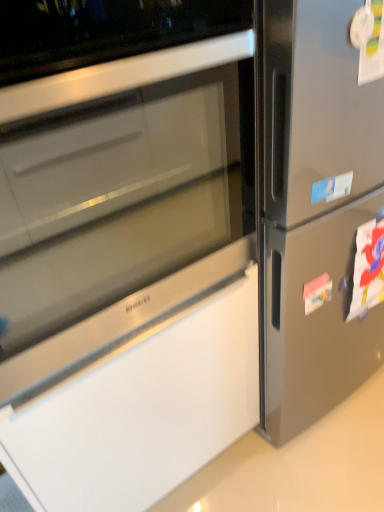
Measure the distance between blue paper sticker at upper right, which is the 1th sticker from front to back, and camera.

blue paper sticker at upper right, which is the 1th sticker from front to back, is 32.13 inches away from camera.

Identify the location of blue paper sticker at upper right, which is the 1th sticker from front to back. (332, 188).

What do you see at coordinates (332, 188) in the screenshot? I see `blue paper sticker at upper right, which is the 1th sticker from front to back` at bounding box center [332, 188].

How much space does blue paper sticker at upper right, positioned as the 2th sticker in bottom-to-top order, occupy vertically?

It is 2.30 inches.

What do you see at coordinates (317, 292) in the screenshot?
I see `pink matte paper at right, positioned as the second sticker in top-to-bottom order` at bounding box center [317, 292].

Locate an element on the screen. pink matte paper at right, which appears as the 1th sticker when viewed from the back is located at coordinates (317, 292).

The height and width of the screenshot is (512, 384). Find the location of `blue paper sticker at upper right, the 2th sticker viewed from the back`. blue paper sticker at upper right, the 2th sticker viewed from the back is located at coordinates (332, 188).

Which object is positioned more to the right, pink matte paper at right, positioned as the second sticker in top-to-bottom order, or blue paper sticker at upper right, positioned as the 2th sticker in bottom-to-top order?

From the viewer's perspective, pink matte paper at right, positioned as the second sticker in top-to-bottom order, appears more on the right side.

Which is behind, pink matte paper at right, positioned as the second sticker in top-to-bottom order, or blue paper sticker at upper right, positioned as the 2th sticker in bottom-to-top order?

pink matte paper at right, positioned as the second sticker in top-to-bottom order, is behind.

Which is nearer, (323,276) or (339,179)?

Positioned in front is point (339,179).

From the image's perspective, which is above, pink matte paper at right, positioned as the first sticker in bottom-to-top order, or blue paper sticker at upper right, positioned as the 2th sticker in bottom-to-top order?

blue paper sticker at upper right, positioned as the 2th sticker in bottom-to-top order, from the image's perspective.

From a real-world perspective, is pink matte paper at right, positioned as the second sticker in top-to-bottom order, physically located above or below blue paper sticker at upper right, the 2th sticker viewed from the back?

pink matte paper at right, positioned as the second sticker in top-to-bottom order, is situated lower than blue paper sticker at upper right, the 2th sticker viewed from the back, in the real world.

Considering the sizes of objects pink matte paper at right, positioned as the second sticker in top-to-bottom order, and blue paper sticker at upper right, positioned as the 2th sticker in bottom-to-top order, in the image provided, who is wider, pink matte paper at right, positioned as the second sticker in top-to-bottom order, or blue paper sticker at upper right, positioned as the 2th sticker in bottom-to-top order,?

pink matte paper at right, positioned as the second sticker in top-to-bottom order.

Is pink matte paper at right, positioned as the first sticker in bottom-to-top order, taller or shorter than blue paper sticker at upper right, positioned as the 2th sticker in bottom-to-top order?

Considering their sizes, pink matte paper at right, positioned as the first sticker in bottom-to-top order, has more height than blue paper sticker at upper right, positioned as the 2th sticker in bottom-to-top order.

Does pink matte paper at right, which appears as the 1th sticker when viewed from the back, have a smaller size compared to blue paper sticker at upper right, which is the 1th sticker from front to back?

Actually, pink matte paper at right, which appears as the 1th sticker when viewed from the back, might be larger than blue paper sticker at upper right, which is the 1th sticker from front to back.

Would you say pink matte paper at right, which appears as the 1th sticker when viewed from the back, contains blue paper sticker at upper right, positioned as the 2th sticker in bottom-to-top order?

No, blue paper sticker at upper right, positioned as the 2th sticker in bottom-to-top order, is not inside pink matte paper at right, which appears as the 1th sticker when viewed from the back.

Are pink matte paper at right, positioned as the first sticker in bottom-to-top order, and blue paper sticker at upper right, positioned as the 2th sticker in bottom-to-top order, far apart?

No.

Could you tell me if pink matte paper at right, positioned as the first sticker in bottom-to-top order, is facing blue paper sticker at upper right, which appears as the first sticker when viewed from the top?

No, pink matte paper at right, positioned as the first sticker in bottom-to-top order, does not turn towards blue paper sticker at upper right, which appears as the first sticker when viewed from the top.

Can you tell me how much pink matte paper at right, positioned as the first sticker in bottom-to-top order, and blue paper sticker at upper right, positioned as the 2th sticker in bottom-to-top order, differ in facing direction?

0.0216 degrees separate the facing orientations of pink matte paper at right, positioned as the first sticker in bottom-to-top order, and blue paper sticker at upper right, positioned as the 2th sticker in bottom-to-top order.

This screenshot has height=512, width=384. I want to click on sticker located below the blue paper sticker at upper right, positioned as the 2th sticker in bottom-to-top order (from the image's perspective), so click(317, 292).

Looking at this image, considering the relative positions of blue paper sticker at upper right, the 2th sticker viewed from the back, and pink matte paper at right, positioned as the first sticker in bottom-to-top order, in the image provided, is blue paper sticker at upper right, the 2th sticker viewed from the back, to the right of pink matte paper at right, positioned as the first sticker in bottom-to-top order, from the viewer's perspective?

In fact, blue paper sticker at upper right, the 2th sticker viewed from the back, is to the left of pink matte paper at right, positioned as the first sticker in bottom-to-top order.

Is blue paper sticker at upper right, positioned as the 2th sticker in bottom-to-top order, closer to camera compared to pink matte paper at right, positioned as the first sticker in bottom-to-top order?

Yes, it is in front of pink matte paper at right, positioned as the first sticker in bottom-to-top order.

Is point (328, 180) less distant than point (327, 298)?

Yes, it is in front of point (327, 298).

From the image's perspective, is blue paper sticker at upper right, which is the 1th sticker from front to back, over pink matte paper at right, the second sticker positioned from the front?

Indeed, from the image's perspective, blue paper sticker at upper right, which is the 1th sticker from front to back, is shown above pink matte paper at right, the second sticker positioned from the front.

From a real-world perspective, is blue paper sticker at upper right, which is the 1th sticker from front to back, above or below pink matte paper at right, the second sticker positioned from the front?

blue paper sticker at upper right, which is the 1th sticker from front to back, is above pink matte paper at right, the second sticker positioned from the front.

Can you confirm if blue paper sticker at upper right, positioned as the 2th sticker in bottom-to-top order, is thinner than pink matte paper at right, the second sticker positioned from the front?

Correct, the width of blue paper sticker at upper right, positioned as the 2th sticker in bottom-to-top order, is less than that of pink matte paper at right, the second sticker positioned from the front.

Consider the image. Considering the sizes of objects blue paper sticker at upper right, the 2th sticker viewed from the back, and pink matte paper at right, which appears as the 1th sticker when viewed from the back, in the image provided, who is taller, blue paper sticker at upper right, the 2th sticker viewed from the back, or pink matte paper at right, which appears as the 1th sticker when viewed from the back,?

pink matte paper at right, which appears as the 1th sticker when viewed from the back, is taller.

Which of these two, blue paper sticker at upper right, positioned as the 2th sticker in bottom-to-top order, or pink matte paper at right, which appears as the 1th sticker when viewed from the back, is smaller?

blue paper sticker at upper right, positioned as the 2th sticker in bottom-to-top order, is smaller.

Can pink matte paper at right, which appears as the 1th sticker when viewed from the back, be found inside blue paper sticker at upper right, positioned as the 2th sticker in bottom-to-top order?

Definitely not — pink matte paper at right, which appears as the 1th sticker when viewed from the back, is not inside blue paper sticker at upper right, positioned as the 2th sticker in bottom-to-top order.

Is blue paper sticker at upper right, which is the 1th sticker from front to back, touching pink matte paper at right, which appears as the 1th sticker when viewed from the back?

No, blue paper sticker at upper right, which is the 1th sticker from front to back, is not touching pink matte paper at right, which appears as the 1th sticker when viewed from the back.

Is pink matte paper at right, the second sticker positioned from the front, at the back of blue paper sticker at upper right, which is the 1th sticker from front to back?

No, blue paper sticker at upper right, which is the 1th sticker from front to back, is not facing away from pink matte paper at right, the second sticker positioned from the front.

Can you tell me how much blue paper sticker at upper right, which appears as the first sticker when viewed from the top, and pink matte paper at right, the second sticker positioned from the front, differ in facing direction?

0.0216 degrees.

You are a GUI agent. You are given a task and a screenshot of the screen. Output one action in this format:
    pyautogui.click(x=<x>, y=<y>)
    Task: Click on the sticker behind the blue paper sticker at upper right, positioned as the 2th sticker in bottom-to-top order
    The height and width of the screenshot is (512, 384).
    Given the screenshot: What is the action you would take?
    pyautogui.click(x=317, y=292)

Where is `sticker above the pink matte paper at right, positioned as the first sticker in bottom-to-top order (from the image's perspective)`? sticker above the pink matte paper at right, positioned as the first sticker in bottom-to-top order (from the image's perspective) is located at coordinates (332, 188).

Identify the location of sticker that appears below the blue paper sticker at upper right, positioned as the 2th sticker in bottom-to-top order (from a real-world perspective). (317, 292).